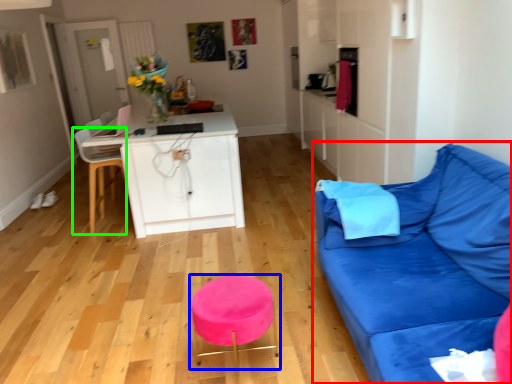
Question: Estimate the real-world distances between objects in this image. Which object is closer to studio couch (highlighted by a red box), bar stool (highlighted by a blue box) or chair (highlighted by a green box)?

Choices:
 (A) bar stool
 (B) chair

Answer: (A)